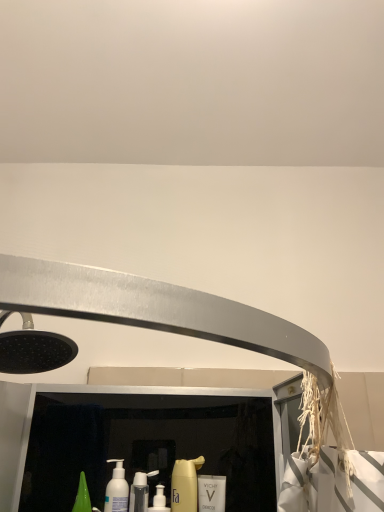
Question: Are white glossy mouthwash at center, which is the second mouthwash in left-to-right order, and yellow matte bottle at center, which ranks as the first cleaning product in right-to-left order, making contact?

Choices:
 (A) yes
 (B) no

Answer: (A)

Question: Considering the relative positions of white glossy mouthwash at center, which is the second mouthwash in left-to-right order, and yellow matte bottle at center, which ranks as the second cleaning product in left-to-right order, in the image provided, is white glossy mouthwash at center, which is the second mouthwash in left-to-right order, to the right of yellow matte bottle at center, which ranks as the second cleaning product in left-to-right order, from the viewer's perspective?

Choices:
 (A) yes
 (B) no

Answer: (A)

Question: Can you confirm if white glossy mouthwash at center, which ranks as the 1th mouthwash in right-to-left order, is bigger than yellow matte bottle at center, which ranks as the first cleaning product in right-to-left order?

Choices:
 (A) no
 (B) yes

Answer: (A)

Question: Is white glossy mouthwash at center, which ranks as the 1th mouthwash in right-to-left order, turned away from yellow matte bottle at center, which ranks as the first cleaning product in right-to-left order?

Choices:
 (A) yes
 (B) no

Answer: (B)

Question: Does white glossy mouthwash at center, which ranks as the 1th mouthwash in right-to-left order, appear on the left side of yellow matte bottle at center, which ranks as the first cleaning product in right-to-left order?

Choices:
 (A) yes
 (B) no

Answer: (B)

Question: Are white glossy mouthwash at center, which ranks as the 1th mouthwash in right-to-left order, and yellow matte bottle at center, which ranks as the first cleaning product in right-to-left order, located far from each other?

Choices:
 (A) yes
 (B) no

Answer: (B)

Question: From the image's perspective, is white glossy mouthwash at center, which ranks as the 1th mouthwash in right-to-left order, over white matte bottle at lower left, the 1th mouthwash from the left?

Choices:
 (A) no
 (B) yes

Answer: (A)

Question: Is white glossy mouthwash at center, which ranks as the 1th mouthwash in right-to-left order, positioned before white matte bottle at lower left, positioned as the second mouthwash in right-to-left order?

Choices:
 (A) no
 (B) yes

Answer: (A)

Question: Is white glossy mouthwash at center, which ranks as the 1th mouthwash in right-to-left order, shorter than white matte bottle at lower left, the 1th mouthwash from the left?

Choices:
 (A) yes
 (B) no

Answer: (A)

Question: Is white glossy mouthwash at center, which ranks as the 1th mouthwash in right-to-left order, to the right of white matte bottle at lower left, positioned as the second mouthwash in right-to-left order, from the viewer's perspective?

Choices:
 (A) yes
 (B) no

Answer: (A)

Question: Considering the relative sizes of white glossy mouthwash at center, which is the second mouthwash in left-to-right order, and white matte bottle at lower left, positioned as the second mouthwash in right-to-left order, in the image provided, is white glossy mouthwash at center, which is the second mouthwash in left-to-right order, wider than white matte bottle at lower left, positioned as the second mouthwash in right-to-left order,?

Choices:
 (A) yes
 (B) no

Answer: (B)

Question: Can you confirm if white glossy mouthwash at center, which ranks as the 1th mouthwash in right-to-left order, is thinner than white matte bottle at lower left, positioned as the second mouthwash in right-to-left order?

Choices:
 (A) no
 (B) yes

Answer: (B)

Question: Is white glossy mouthwash at center, which ranks as the 1th mouthwash in right-to-left order, placed right next to white glossy bottle at center, which is counted as the 1th cleaning product, starting from the left?

Choices:
 (A) no
 (B) yes

Answer: (A)